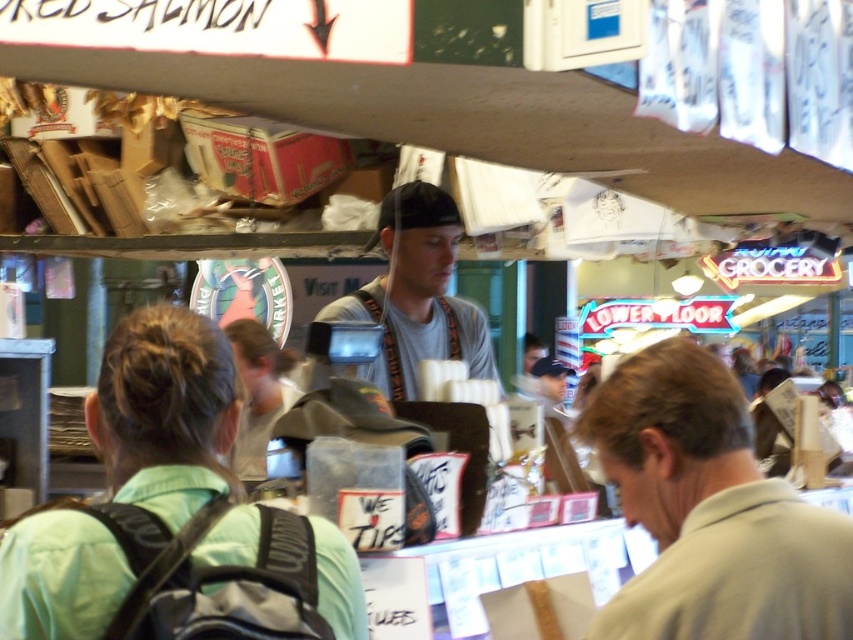
Between green fabric backpack at lower left and gray fabric shirt at center, which one is positioned lower?

Positioned lower is green fabric backpack at lower left.

Who is positioned more to the right, green fabric backpack at lower left or gray fabric shirt at center?

gray fabric shirt at center

The height and width of the screenshot is (640, 853). In order to click on green fabric backpack at lower left in this screenshot , I will do `click(173, 426)`.

I want to click on green fabric backpack at lower left, so click(173, 426).

The height and width of the screenshot is (640, 853). Find the location of `gray cotton shirt at center`. gray cotton shirt at center is located at coordinates (709, 512).

Between gray cotton shirt at center and gray fabric cap at center, which one is positioned lower?

gray fabric cap at center

Describe the element at coordinates (709, 512) in the screenshot. I see `gray cotton shirt at center` at that location.

You are a GUI agent. You are given a task and a screenshot of the screen. Output one action in this format:
    pyautogui.click(x=<x>, y=<y>)
    Task: Click on the gray cotton shirt at center
    Image resolution: width=853 pixels, height=640 pixels.
    Given the screenshot: What is the action you would take?
    pyautogui.click(x=709, y=512)

Is gray cotton shirt at center thinner than green fabric backpack at lower left?

Yes.

Between point (635, 396) and point (51, 556), which one is positioned in front?

Positioned in front is point (51, 556).

Locate an element on the screen. This screenshot has height=640, width=853. gray cotton shirt at center is located at coordinates (709, 512).